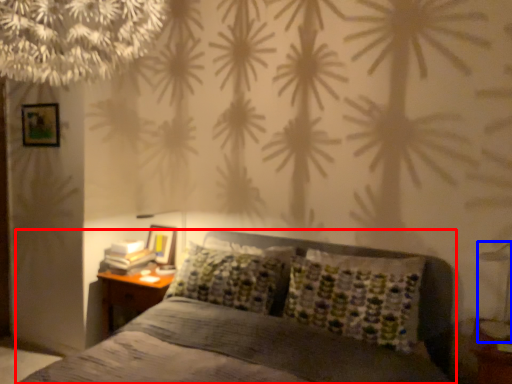
Question: Which object appears farthest to the camera in this image, bed (highlighted by a red box) or bedside lamp (highlighted by a blue box)?

Choices:
 (A) bed
 (B) bedside lamp

Answer: (B)